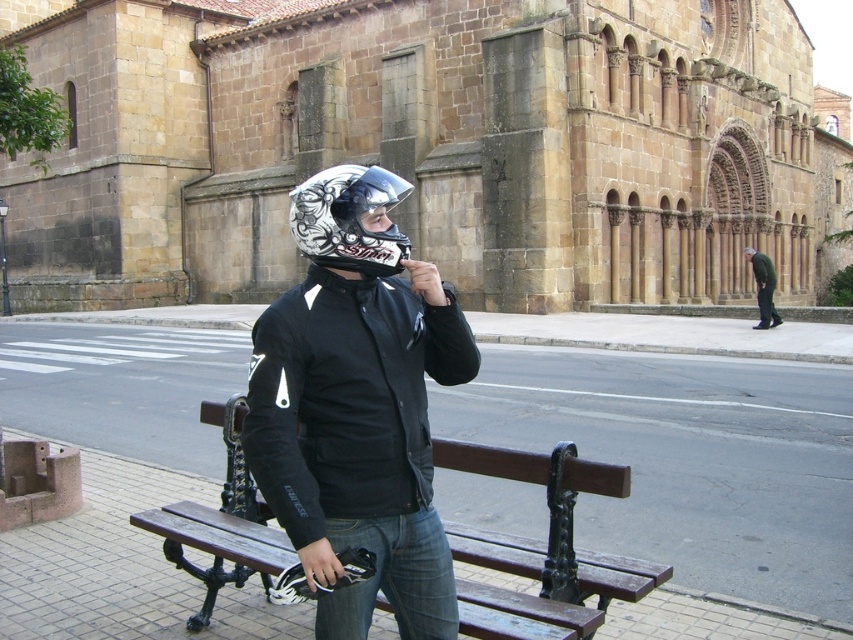
Between brown wooden bench at center and glossy black helmet at center, which one has more height?

glossy black helmet at center is taller.

Between brown wooden bench at center and glossy black helmet at center, which one appears on the right side from the viewer's perspective?

From the viewer's perspective, brown wooden bench at center appears more on the right side.

Who is more distant from viewer, (631, 588) or (289, 227)?

The point (289, 227) is behind.

This screenshot has height=640, width=853. In order to click on brown wooden bench at center in this screenshot , I will do `click(543, 548)`.

Looking at this image, between brown wooden bench at center and dark green fabric jacket at lower right, which one is positioned lower?

brown wooden bench at center

Who is taller, brown wooden bench at center or dark green fabric jacket at lower right?

dark green fabric jacket at lower right is taller.

Is point (173, 515) farther from viewer compared to point (746, 248)?

No, it is not.

This screenshot has width=853, height=640. I want to click on brown wooden bench at center, so click(x=543, y=548).

Based on the photo, is matte black helmet at center smaller than transparent plastic goggles at center?

Yes, matte black helmet at center is smaller than transparent plastic goggles at center.

Between matte black helmet at center and transparent plastic goggles at center, which one has more height?

transparent plastic goggles at center

Who is more forward, (404, 445) or (329, 180)?

Point (404, 445) is more forward.

This screenshot has width=853, height=640. What are the coordinates of `matte black helmet at center` in the screenshot? It's located at (357, 417).